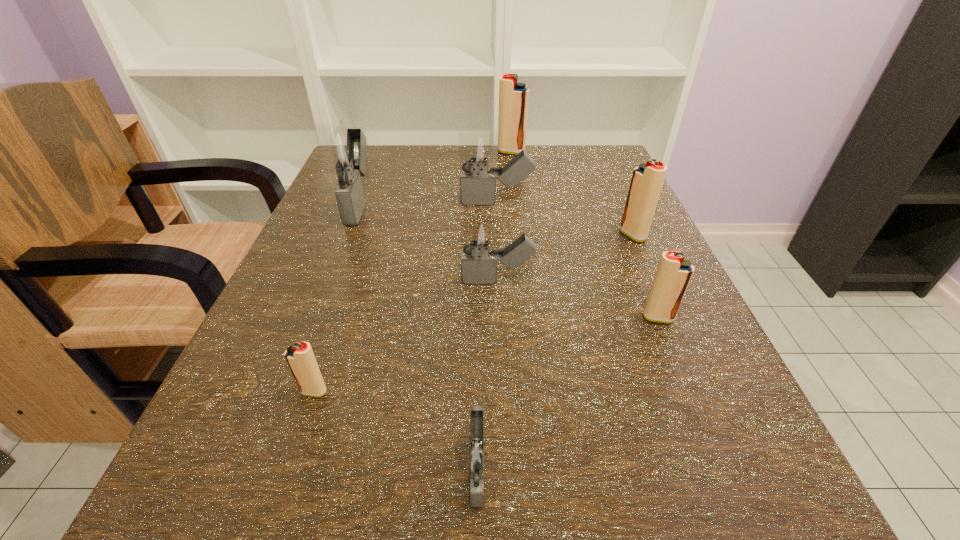
The width and height of the screenshot is (960, 540). I want to click on vacant space situated on the right of the nearest igniter, so click(x=719, y=468).

In order to click on object present at the near edge in this screenshot , I will do `click(476, 455)`.

You are a GUI agent. You are given a task and a screenshot of the screen. Output one action in this format:
    pyautogui.click(x=<x>, y=<y>)
    Task: Click on the object that is at the far left corner
    The width and height of the screenshot is (960, 540).
    Given the screenshot: What is the action you would take?
    pyautogui.click(x=342, y=150)

In order to click on blank space at the far edge of the desktop in this screenshot , I will do `click(417, 150)`.

The height and width of the screenshot is (540, 960). I want to click on vacant space at the near edge of the desktop, so click(635, 525).

Identify the location of free location at the left edge. The image size is (960, 540). (313, 288).

You are a GUI agent. You are given a task and a screenshot of the screen. Output one action in this format:
    pyautogui.click(x=<x>, y=<y>)
    Task: Click on the vacant region at the right edge of the desktop
    This screenshot has height=540, width=960.
    Given the screenshot: What is the action you would take?
    pyautogui.click(x=670, y=360)

Identify the location of free space at the far left corner. The width and height of the screenshot is (960, 540). (395, 157).

Image resolution: width=960 pixels, height=540 pixels. Identify the location of free space at the far right corner of the desktop. (612, 149).

I want to click on vacant space at the near right corner of the desktop, so click(x=639, y=499).